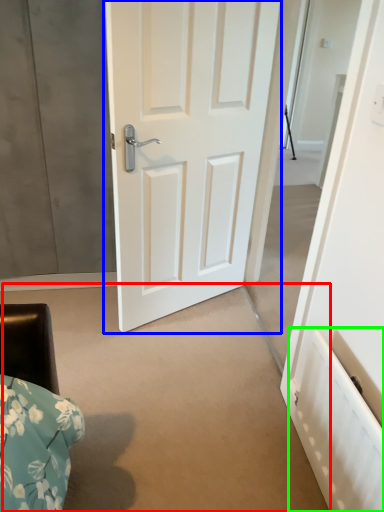
Question: Estimate the real-world distances between objects in this image. Which object is farther from concrete (highlighted by a red box), door (highlighted by a blue box) or radiator (highlighted by a green box)?

Choices:
 (A) door
 (B) radiator

Answer: (A)